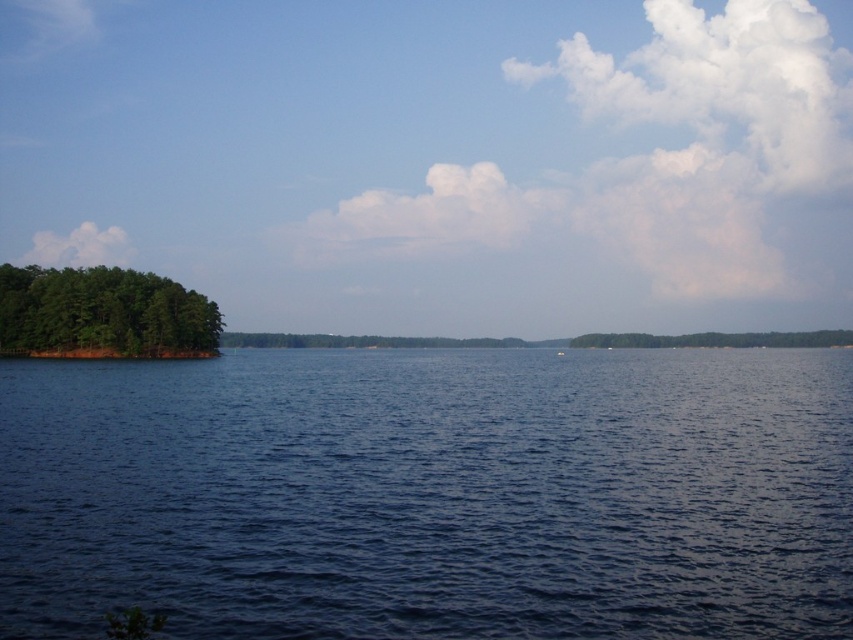
You are a bird soaring over the lakeside scene. You notice a point marked at coordinates (727, 83). What is located at that point?

The point at coordinates (727, 83) marks a white fluffy cloud at upper right.

You are a photographer standing at the lakeside. You want to capture a photo where the dark blue water at center is clearly visible in front of the white fluffy cloud at upper right. Is this possible based on their positions?

Yes, because the dark blue water at center is in front of the white fluffy cloud at upper right, so the water will appear in front of the cloud in the photo.